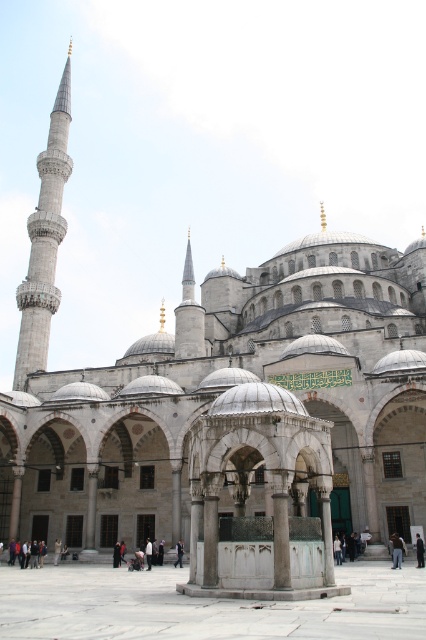
Can you confirm if dark gray fabric person at center is positioned to the left of white fabric person at center?

Correct, you'll find dark gray fabric person at center to the left of white fabric person at center.

Is dark gray fabric person at center thinner than white fabric person at center?

In fact, dark gray fabric person at center might be wider than white fabric person at center.

Is point (149, 538) positioned behind point (181, 557)?

Yes, point (149, 538) is behind point (181, 557).

Where is `dark gray fabric person at center`? dark gray fabric person at center is located at coordinates (149, 552).

Based on the photo, between gray stone minaret at left and dark gray fabric person at center, which one is positioned higher?

gray stone minaret at left is above.

Describe the element at coordinates (45, 241) in the screenshot. The height and width of the screenshot is (640, 426). I see `gray stone minaret at left` at that location.

What do you see at coordinates (45, 241) in the screenshot? I see `gray stone minaret at left` at bounding box center [45, 241].

Where is `gray stone minaret at left`? gray stone minaret at left is located at coordinates (45, 241).

Who is positioned more to the left, brown leather jacket at lower right or dark gray fabric person at center?

Positioned to the left is dark gray fabric person at center.

What do you see at coordinates (397, 548) in the screenshot? I see `brown leather jacket at lower right` at bounding box center [397, 548].

What are the coordinates of `brown leather jacket at lower right` in the screenshot? It's located at (397, 548).